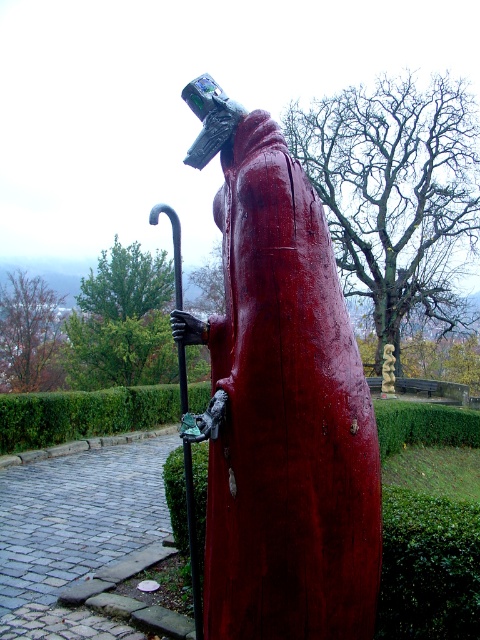
Question: Does green hedge at lower left have a greater width compared to black metal pole at center?

Choices:
 (A) no
 (B) yes

Answer: (A)

Question: Can you confirm if green hedge at lower left is smaller than black metal pole at center?

Choices:
 (A) no
 (B) yes

Answer: (B)

Question: Can you confirm if green hedge at lower left is positioned to the left of wooden spiral at center?

Choices:
 (A) yes
 (B) no

Answer: (A)

Question: Which object is positioned closest to the wooden spiral at center?

Choices:
 (A) green hedge at lower left
 (B) glossy wood statue at center
 (C) black metal pole at center

Answer: (A)

Question: Which of the following is the farthest from the observer?

Choices:
 (A) wooden spiral at center
 (B) glossy wood statue at center

Answer: (A)

Question: Which point is closer to the camera?

Choices:
 (A) glossy wood statue at center
 (B) green hedge at lower left
 (C) wooden spiral at center
 (D) black metal pole at center

Answer: (A)